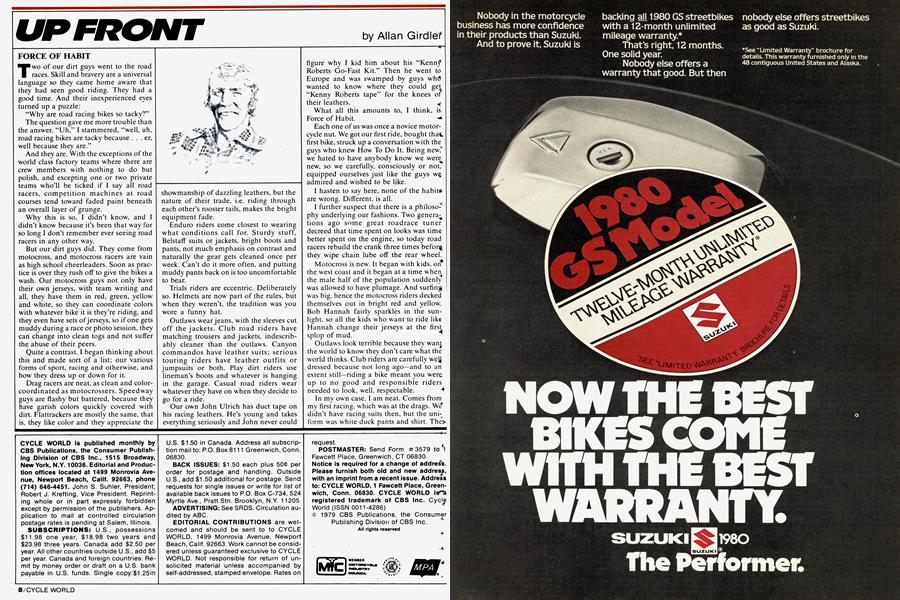
Locate an element on the screen. The width and height of the screenshot is (900, 600). cd is located at coordinates (644, 338).